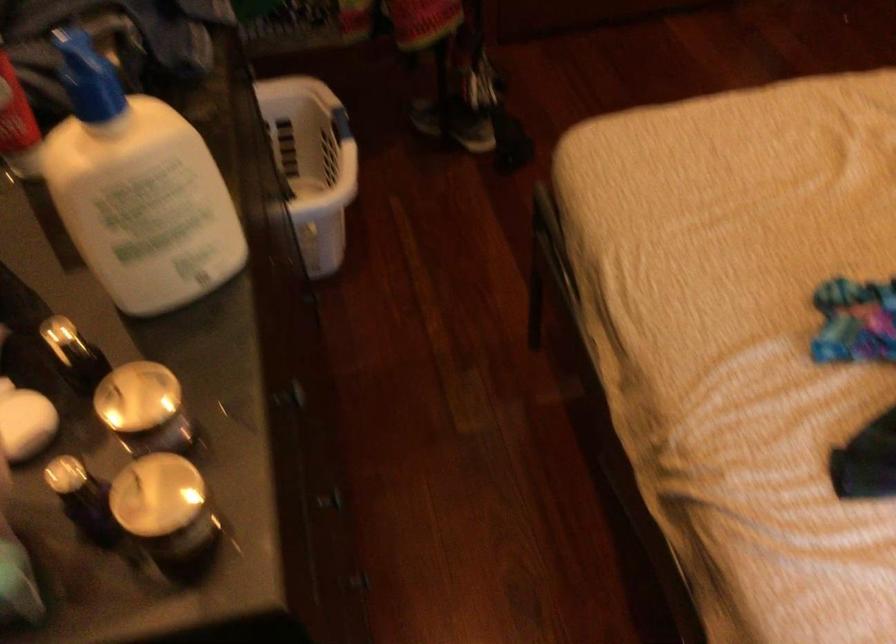
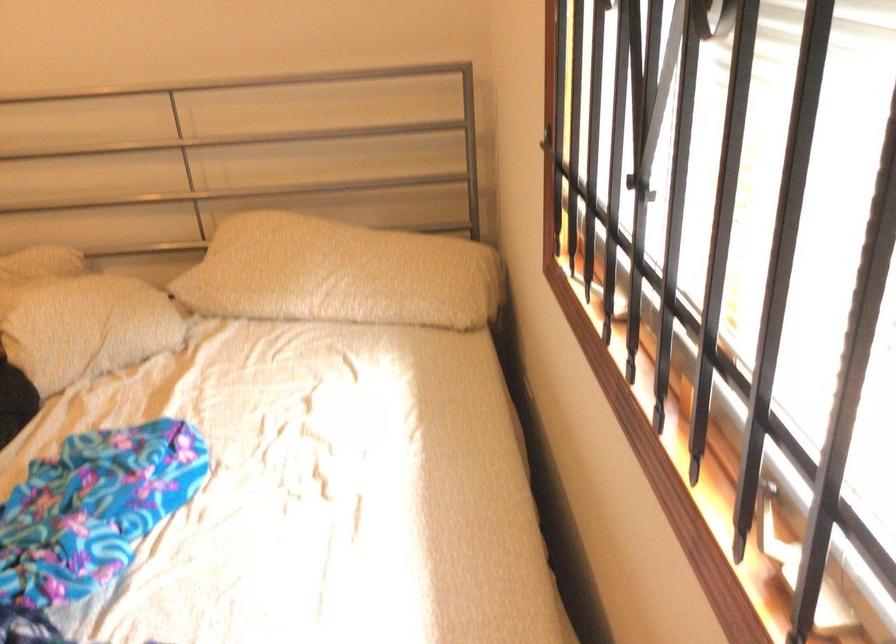
Question: The first image is from the beginning of the video and the second image is from the end. How did the camera likely rotate when shooting the video?

Choices:
 (A) Left
 (B) Right
 (C) Up
 (D) Down

Answer: (B)